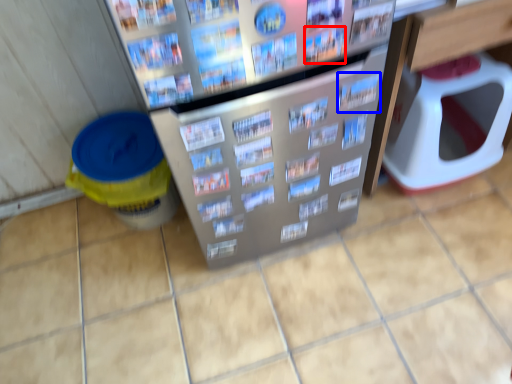
Question: Which object is closer to the camera taking this photo, magazine (highlighted by a red box) or magazine (highlighted by a blue box)?

Choices:
 (A) magazine
 (B) magazine

Answer: (A)